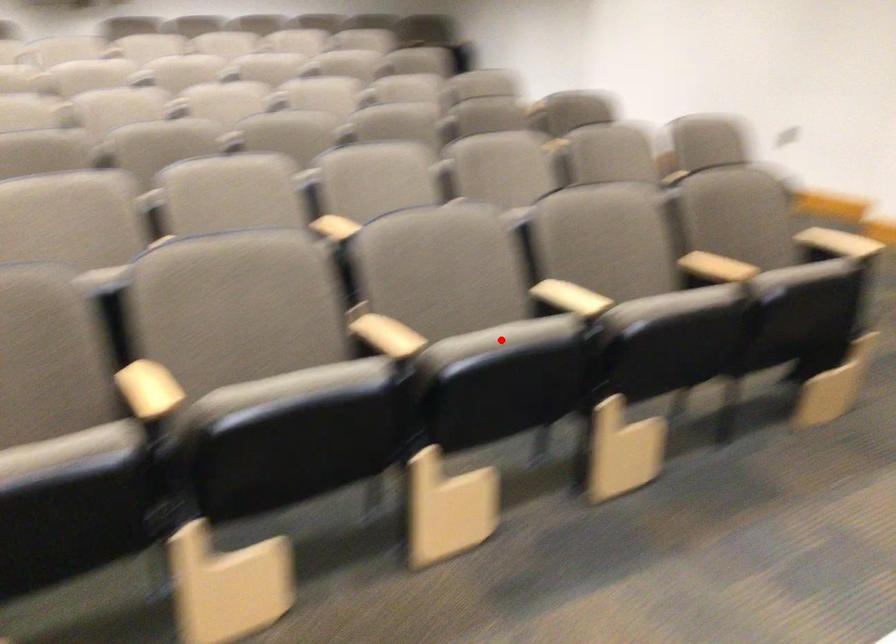
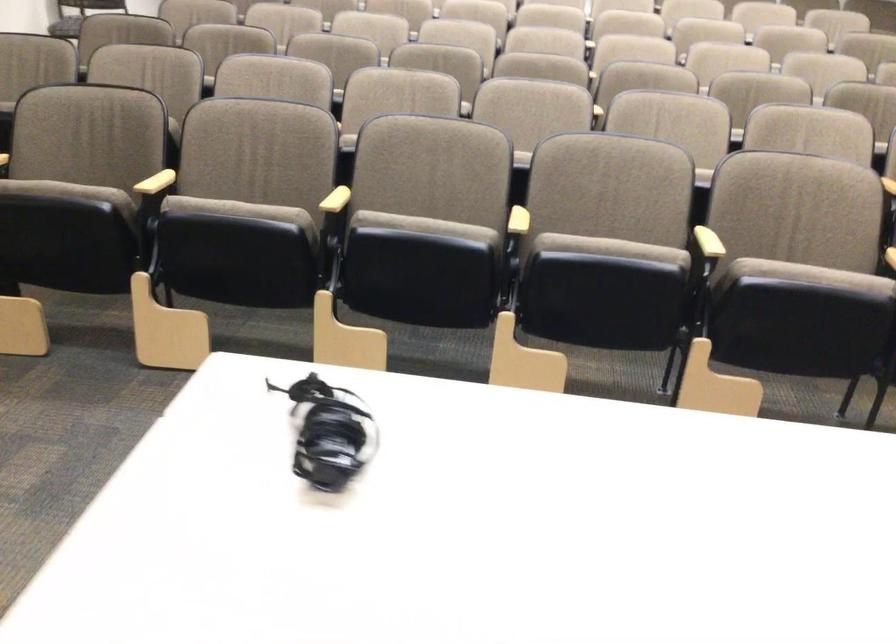
Question: I am providing you with two images of the same scene from different viewpoints. In image1, a red point is highlighted. Considering the same 3D point in image2, which of the following is correct?

Choices:
 (A) It is closer
 (B) It is farther

Answer: (B)